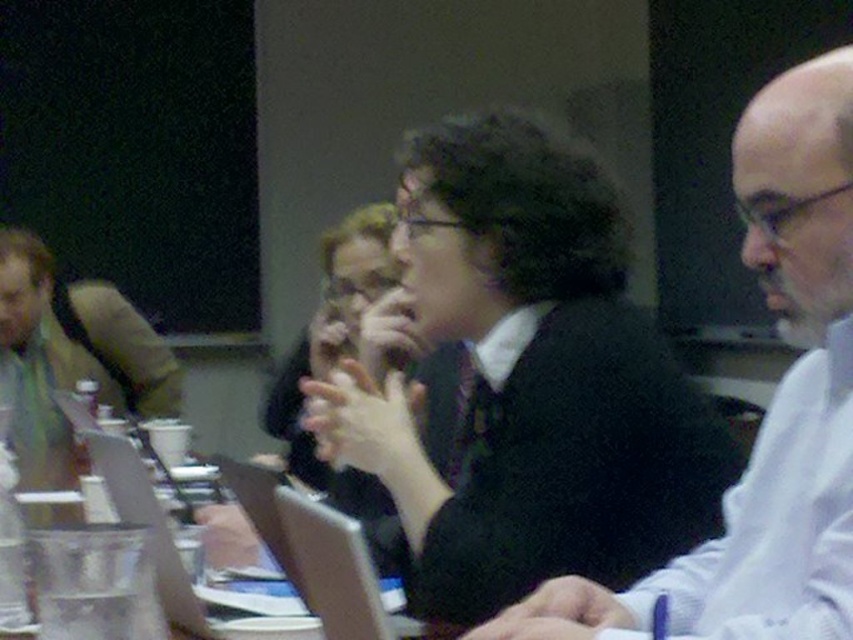
Is black matte suit at center positioned at the back of black sweater at center?

That is True.

Measure the distance from black matte suit at center to black sweater at center.

The distance of black matte suit at center from black sweater at center is 9.97 inches.

Between point (527, 288) and point (775, 269), which one is positioned in front?

Point (775, 269)

Where is `black matte suit at center`? The height and width of the screenshot is (640, 853). black matte suit at center is located at coordinates (529, 381).